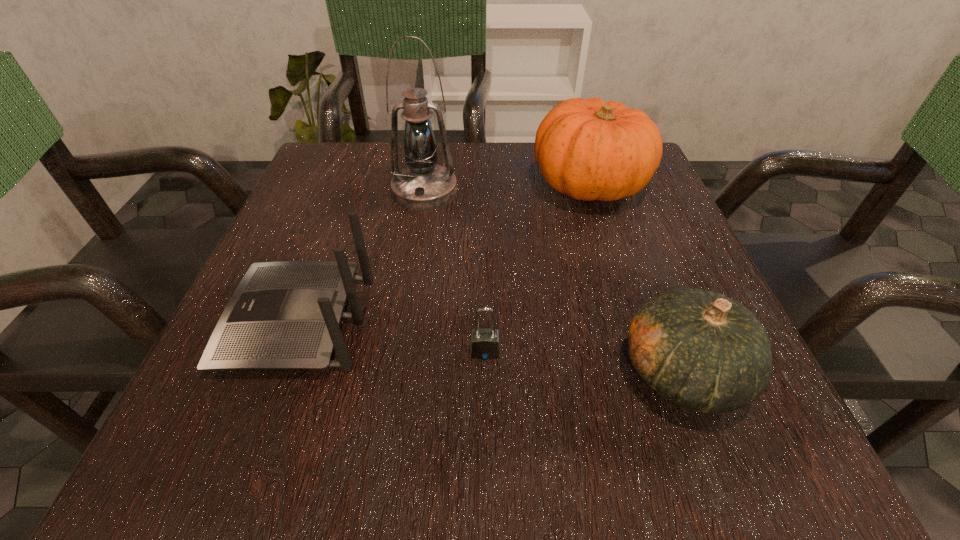
The width and height of the screenshot is (960, 540). In order to click on oil lamp in this screenshot , I will do `click(423, 185)`.

At what (x,y) coordinates should I click in order to perform the action: click on pumpkin. Please return your answer as a coordinate pair (x, y). Looking at the image, I should click on (589, 149).

Where is `router`? router is located at coordinates (283, 315).

Image resolution: width=960 pixels, height=540 pixels. I want to click on gourd, so click(x=706, y=352).

This screenshot has width=960, height=540. What are the coordinates of `the shortest object` in the screenshot? It's located at (484, 344).

I want to click on padlock, so click(x=484, y=344).

Find the location of a particular element. The height and width of the screenshot is (540, 960). vacant space positioned on the front of the oil lamp is located at coordinates (404, 322).

Identify the location of free region located on the left of the pumpkin. The image size is (960, 540). (456, 184).

Locate an element on the screen. vacant area located on the left of the gourd is located at coordinates (577, 373).

Locate an element on the screen. The width and height of the screenshot is (960, 540). vacant space located on the shackle of the padlock is located at coordinates (486, 413).